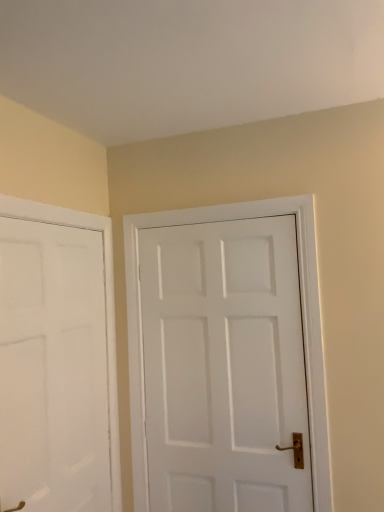
Question: Is white matte door at left, acting as the first door starting from the left, outside white matte door at center, which is the 1th door in right-to-left order?

Choices:
 (A) yes
 (B) no

Answer: (A)

Question: Would you say white matte door at left, acting as the first door starting from the left, contains white matte door at center, which is the 1th door in right-to-left order?

Choices:
 (A) yes
 (B) no

Answer: (B)

Question: Considering the relative sizes of white matte door at left, placed as the 2th door when sorted from right to left, and white matte door at center, which is the 1th door in right-to-left order, in the image provided, is white matte door at left, placed as the 2th door when sorted from right to left, shorter than white matte door at center, which is the 1th door in right-to-left order,?

Choices:
 (A) yes
 (B) no

Answer: (A)

Question: Is white matte door at left, acting as the first door starting from the left, facing away from white matte door at center, which ranks as the 2th door in left-to-right order?

Choices:
 (A) no
 (B) yes

Answer: (A)

Question: Does white matte door at left, placed as the 2th door when sorted from right to left, turn towards white matte door at center, which ranks as the 2th door in left-to-right order?

Choices:
 (A) no
 (B) yes

Answer: (B)

Question: Does white matte door at left, acting as the first door starting from the left, have a lesser width compared to white matte door at center, which is the 1th door in right-to-left order?

Choices:
 (A) yes
 (B) no

Answer: (A)

Question: Is white matte door at center, which is the 1th door in right-to-left order, beside white matte door at left, acting as the first door starting from the left?

Choices:
 (A) no
 (B) yes

Answer: (A)

Question: Does white matte door at center, which is the 1th door in right-to-left order, have a greater height compared to white matte door at left, placed as the 2th door when sorted from right to left?

Choices:
 (A) yes
 (B) no

Answer: (A)

Question: Can you confirm if white matte door at center, which ranks as the 2th door in left-to-right order, is positioned to the right of white matte door at left, placed as the 2th door when sorted from right to left?

Choices:
 (A) yes
 (B) no

Answer: (A)

Question: From the image's perspective, is white matte door at center, which ranks as the 2th door in left-to-right order, under white matte door at left, acting as the first door starting from the left?

Choices:
 (A) yes
 (B) no

Answer: (B)

Question: Can white matte door at left, placed as the 2th door when sorted from right to left, be found inside white matte door at center, which is the 1th door in right-to-left order?

Choices:
 (A) yes
 (B) no

Answer: (B)

Question: Would you say white matte door at center, which ranks as the 2th door in left-to-right order, is outside white matte door at left, placed as the 2th door when sorted from right to left?

Choices:
 (A) no
 (B) yes

Answer: (B)

Question: Is point (1, 315) closer or farther from the camera than point (243, 398)?

Choices:
 (A) closer
 (B) farther

Answer: (A)